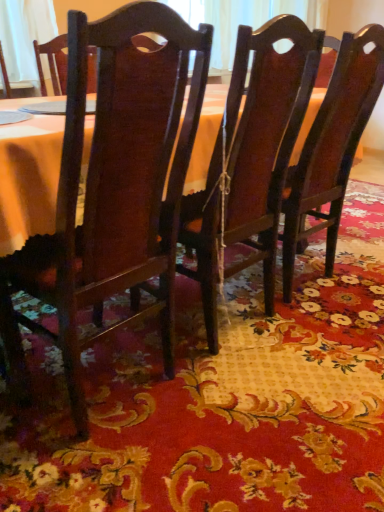
Locate an element on the screen. Image resolution: width=384 pixels, height=512 pixels. free spot to the right of glossy wood chair at center, the first chair in the right-to-left sequence is located at coordinates (359, 266).